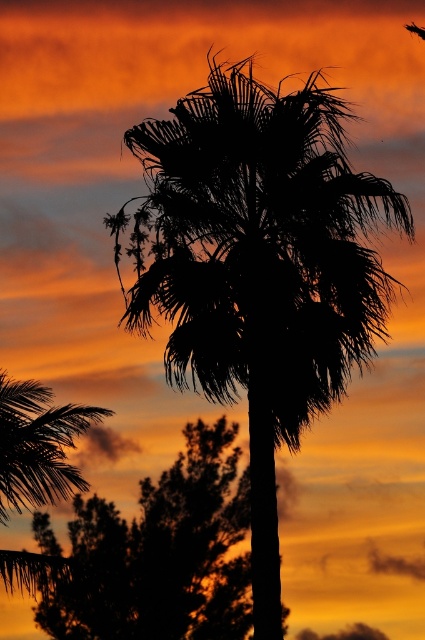
Is silhouette leafy tree at center behind silky black palm tree at upper left?

Yes, it is behind silky black palm tree at upper left.

How distant is silhouette leafy tree at center from silky black palm tree at upper left?

silhouette leafy tree at center and silky black palm tree at upper left are 2.05 meters apart from each other.

Who is more distant from viewer, (251,605) or (76,476)?

The point (251,605) is more distant.

The height and width of the screenshot is (640, 425). In order to click on silhouette leafy tree at center in this screenshot , I will do `click(161, 554)`.

Based on the photo, can you confirm if black silhouette palm tree at center is bigger than silky black palm tree at upper left?

Incorrect, black silhouette palm tree at center is not larger than silky black palm tree at upper left.

Is black silhouette palm tree at center to the right of silky black palm tree at upper left from the viewer's perspective?

Indeed, black silhouette palm tree at center is positioned on the right side of silky black palm tree at upper left.

Locate an element on the screen. black silhouette palm tree at center is located at coordinates 258,266.

Between point (343, 337) and point (161, 604), which one is positioned in front?

Point (343, 337) is more forward.

Does black silhouette palm tree at center have a lesser height compared to silhouette leafy tree at center?

Indeed, black silhouette palm tree at center has a lesser height compared to silhouette leafy tree at center.

Which is in front, point (183, 284) or point (90, 600)?

Positioned in front is point (183, 284).

Find the location of a particular element. Image resolution: width=425 pixels, height=640 pixels. black silhouette palm tree at center is located at coordinates coord(258,266).